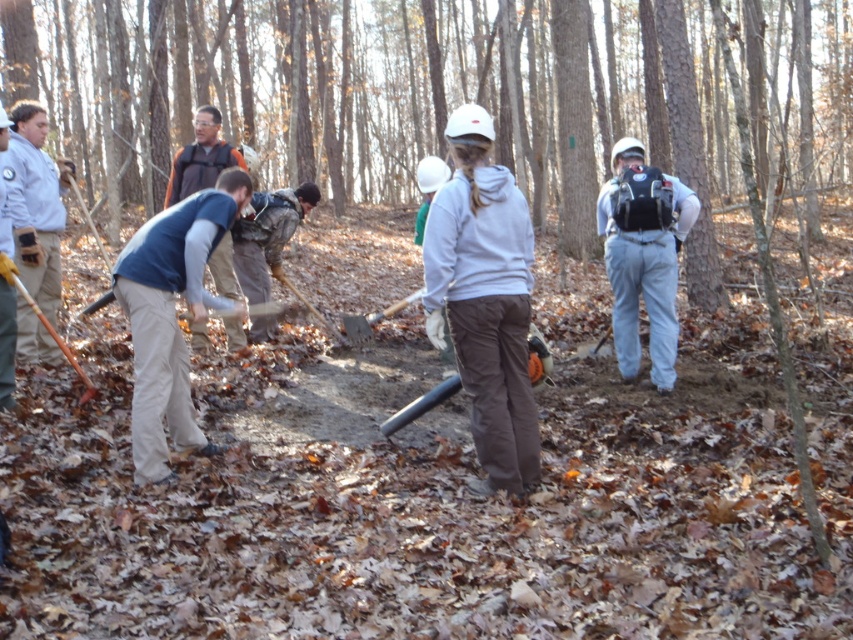
You are a member of the work crew and need to retrieve your wooden shovel at left. However, there is an orange vest at center in your way. Can you reach your shovel without moving the vest?

The orange vest at center is positioned over the wooden shovel at left, so you cannot reach the wooden shovel at left without moving the vest first.

You are standing in the wooded area and need to locate the wooden shovel at left. Which direction should you move relative to the light blue jeans at center?

The wooden shovel at left is to the left of the light blue jeans at center, so you should move to the left relative to the light blue jeans at center to find it.